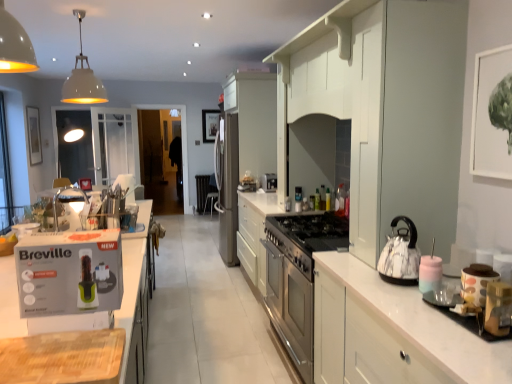
You are a GUI agent. You are given a task and a screenshot of the screen. Output one action in this format:
    pyautogui.click(x=<x>, y=<y>)
    Task: Click on the white matte pendant lamp at upper center
    This screenshot has width=512, height=384.
    Given the screenshot: What is the action you would take?
    pyautogui.click(x=83, y=79)

Locate an element on the screen. black matte picture frame at upper center, the 1th picture frame when ordered from back to front is located at coordinates (210, 125).

What do you see at coordinates (400, 255) in the screenshot?
I see `white marble teapot at right` at bounding box center [400, 255].

Measure the distance between point (41, 153) and camera.

Point (41, 153) is 19.94 feet away from camera.

In order to face black fabric chair at center, should I rotate leftwards or rightwards?

Turn left by 5.843 degrees to look at black fabric chair at center.

At what (x,y) coordinates should I click in order to perform the action: click on white matte pendant lamp at upper center. Please return your answer as a coordinate pair (x, y). Looking at the image, I should click on (83, 79).

Is polka dot ceramic jar at right, acting as the second appliance starting from the front, smaller than white matte cabinet at right, which appears as the third cabinetry when viewed from the back?

Indeed, polka dot ceramic jar at right, acting as the second appliance starting from the front, has a smaller size compared to white matte cabinet at right, which appears as the third cabinetry when viewed from the back.

Which is closer to the camera, (469, 303) or (318, 20)?

Point (469, 303) is positioned closer to the camera compared to point (318, 20).

Is polka dot ceramic jar at right, the first appliance when ordered from back to front, surrounding white matte cabinet at right, which is the second cabinetry from front to back?

That's incorrect, white matte cabinet at right, which is the second cabinetry from front to back, is not inside polka dot ceramic jar at right, the first appliance when ordered from back to front.

Is polka dot ceramic jar at right, acting as the second appliance starting from the front, oriented away from white matte cabinet at right, which appears as the third cabinetry when viewed from the back?

polka dot ceramic jar at right, acting as the second appliance starting from the front, does not have its back to white matte cabinet at right, which appears as the third cabinetry when viewed from the back.

Are white matte pendant lamp at upper center and translucent plastic bottle at upper center, which is the 2th bottle in back-to-front order, located far from each other?

That's right, there is a large distance between white matte pendant lamp at upper center and translucent plastic bottle at upper center, which is the 2th bottle in back-to-front order.

How different are the orientations of white matte pendant lamp at upper center and translucent plastic bottle at upper center, which is the first bottle in front-to-back order, in degrees?

87.8 degrees separate the facing orientations of white matte pendant lamp at upper center and translucent plastic bottle at upper center, which is the first bottle in front-to-back order.

Does white matte pendant lamp at upper center turn towards translucent plastic bottle at upper center, which is the 2th bottle in left-to-right order?

No, white matte pendant lamp at upper center is not aimed at translucent plastic bottle at upper center, which is the 2th bottle in left-to-right order.

From the picture: Is satin white cabinetry at center, positioned as the 2th cabinetry in back-to-front order, not near black fabric chair at center?

Indeed, satin white cabinetry at center, positioned as the 2th cabinetry in back-to-front order, is not near black fabric chair at center.

From a real-world perspective, is satin white cabinetry at center, positioned as the 2th cabinetry in back-to-front order, positioned above or below black fabric chair at center?

Clearly, from a real-world perspective, satin white cabinetry at center, positioned as the 2th cabinetry in back-to-front order, is above black fabric chair at center.

Could you tell me if satin white cabinetry at center, positioned as the 2th cabinetry in back-to-front order, is turned towards black fabric chair at center?

No, satin white cabinetry at center, positioned as the 2th cabinetry in back-to-front order, is not turned towards black fabric chair at center.

From the image's perspective, is polka dot ceramic jar at right, acting as the second appliance starting from the front, on top of metallic gold toaster at right, the first appliance viewed from the front?

Indeed, from the image's perspective, polka dot ceramic jar at right, acting as the second appliance starting from the front, is shown above metallic gold toaster at right, the first appliance viewed from the front.

In terms of height, does polka dot ceramic jar at right, acting as the second appliance starting from the front, look taller or shorter compared to metallic gold toaster at right, acting as the 2th appliance starting from the back?

polka dot ceramic jar at right, acting as the second appliance starting from the front, is taller than metallic gold toaster at right, acting as the 2th appliance starting from the back.

Is polka dot ceramic jar at right, the first appliance when ordered from back to front, directly adjacent to metallic gold toaster at right, acting as the 2th appliance starting from the back?

Yes, polka dot ceramic jar at right, the first appliance when ordered from back to front, is right next to metallic gold toaster at right, acting as the 2th appliance starting from the back, and making contact.

Who is smaller, polka dot ceramic jar at right, acting as the second appliance starting from the front, or metallic gold toaster at right, acting as the 2th appliance starting from the back?

With smaller size is metallic gold toaster at right, acting as the 2th appliance starting from the back.

Is metallic gold toaster at right, acting as the 2th appliance starting from the back, completely or partially outside of polka dot ceramic jar at right, the first appliance when ordered from back to front?

metallic gold toaster at right, acting as the 2th appliance starting from the back, is positioned outside polka dot ceramic jar at right, the first appliance when ordered from back to front.

Can you confirm if metallic gold toaster at right, the first appliance viewed from the front, is positioned to the right of polka dot ceramic jar at right, acting as the second appliance starting from the front?

In fact, metallic gold toaster at right, the first appliance viewed from the front, is to the left of polka dot ceramic jar at right, acting as the second appliance starting from the front.

Is metallic gold toaster at right, acting as the 2th appliance starting from the back, turned away from polka dot ceramic jar at right, acting as the second appliance starting from the front?

No, metallic gold toaster at right, acting as the 2th appliance starting from the back, is not facing the opposite direction of polka dot ceramic jar at right, acting as the second appliance starting from the front.

From the image's perspective, is metallic gold toaster at right, acting as the 2th appliance starting from the back, located above polka dot ceramic jar at right, acting as the second appliance starting from the front?

No.

From the picture: From the image's perspective, is white marble teapot at right on top of translucent plastic bottle at center, acting as the second bottle starting from the right?

No.

At what (x,y) coordinates should I click in order to perform the action: click on the 2nd bottle behind the white marble teapot at right. Please return your answer as a coordinate pair (x, y). Looking at the image, I should click on (317, 200).

Based on the photo, can you confirm if white marble teapot at right is positioned to the right of translucent plastic bottle at center, the second bottle positioned from the front?

Yes, white marble teapot at right is to the right of translucent plastic bottle at center, the second bottle positioned from the front.

Which is nearer, (383, 262) or (317, 206)?

Result: The point (383, 262) is more forward.

Which object is further away from the camera taking this photo, white cardboard box at left or transparent glass screen door at center?

transparent glass screen door at center is further away from the camera.

Does white cardboard box at left have a greater height compared to transparent glass screen door at center?

In fact, white cardboard box at left may be shorter than transparent glass screen door at center.

Can you confirm if white cardboard box at left is positioned to the left of transparent glass screen door at center?

Incorrect, white cardboard box at left is not on the left side of transparent glass screen door at center.

Considering the relative sizes of white cardboard box at left and transparent glass screen door at center in the image provided, is white cardboard box at left smaller than transparent glass screen door at center?

Correct, white cardboard box at left occupies less space than transparent glass screen door at center.

Find the location of a particular element. the 1st appliance in front of the white matte cabinet at right, which is the second cabinetry from front to back, starting your count from the anchor is located at coordinates (476, 283).

Image resolution: width=512 pixels, height=384 pixels. I want to click on light fixture on the left of the translucent plastic bottle at upper center, which is the 2th bottle in back-to-front order, so point(83,79).

Which object lies nearer to the anchor point white cardboard box at left, black fabric chair at center or white matte cabinet at right, which is the second cabinetry from front to back?

white matte cabinet at right, which is the second cabinetry from front to back, is positioned closer to the anchor white cardboard box at left.

Looking at the image, which one is located closer to translucent plastic bottle at center, positioned as the 1th bottle in left-to-right order, wooden cutting board at lower left or white matte cabinet at right, which appears as the third cabinetry when viewed from the back?

white matte cabinet at right, which appears as the third cabinetry when viewed from the back, is positioned closer to the anchor translucent plastic bottle at center, positioned as the 1th bottle in left-to-right order.

Which object lies nearer to the anchor point white matte pendant lamp at upper center, black fabric chair at center or transparent glass screen door at center?

Among the two, black fabric chair at center is located nearer to white matte pendant lamp at upper center.

Looking at this image, which object lies nearer to the anchor point polka dot ceramic jar at right, the first appliance when ordered from back to front, black fabric chair at center or wooden cutting board at lower left?

wooden cutting board at lower left is closer to polka dot ceramic jar at right, the first appliance when ordered from back to front.

Based on their spatial positions, is white matte cabinet at right, which appears as the third cabinetry when viewed from the back, or satin white cabinetry at center, which is the 3th cabinetry in front-to-back order, closer to satin silver coffee machine at center?

Based on the image, satin white cabinetry at center, which is the 3th cabinetry in front-to-back order, appears to be nearer to satin silver coffee machine at center.

Which object lies further to the anchor point black fabric chair at center, satin white cabinetry at center, which is the 3th cabinetry in front-to-back order, or white cardboard box at left?

Based on the image, white cardboard box at left appears to be further to black fabric chair at center.

Looking at the image, which one is located closer to white glossy cabinet at right, the first cabinetry in the front-to-back sequence, matte white picture frame at upper left, which is the 1th picture frame from left to right, or wooden cutting board at lower left?

Among the two, wooden cutting board at lower left is located nearer to white glossy cabinet at right, the first cabinetry in the front-to-back sequence.

When comparing their distances from satin white cabinetry at center, positioned as the 2th cabinetry in back-to-front order, does polka dot ceramic jar at right, the first appliance when ordered from back to front, or black fabric chair at center seem closer?

polka dot ceramic jar at right, the first appliance when ordered from back to front.

I want to click on coffee machine between white cardboard box at left and black matte picture frame at upper center, the 1th picture frame when ordered from back to front, along the z-axis, so click(269, 182).

Find the location of a particular element. screen door between white matte cabinet at right, which is the second cabinetry from front to back, and black matte picture frame at upper center, the 1th picture frame when ordered from right to left, in the front-back direction is located at coordinates (183, 142).

You are a GUI agent. You are given a task and a screenshot of the screen. Output one action in this format:
    pyautogui.click(x=<x>, y=<y>)
    Task: Click on the screen door between white matte pendant lamp at upper center and black matte picture frame at upper center, which ranks as the 2th picture frame in front-to-back order, from front to back
    The width and height of the screenshot is (512, 384).
    Given the screenshot: What is the action you would take?
    pyautogui.click(x=183, y=142)

Locate an element on the screen. This screenshot has width=512, height=384. cardboard box positioned between wooden cutting board at lower left and white glossy cabinet at center, acting as the 1th cabinetry starting from the back, from near to far is located at coordinates (69, 272).